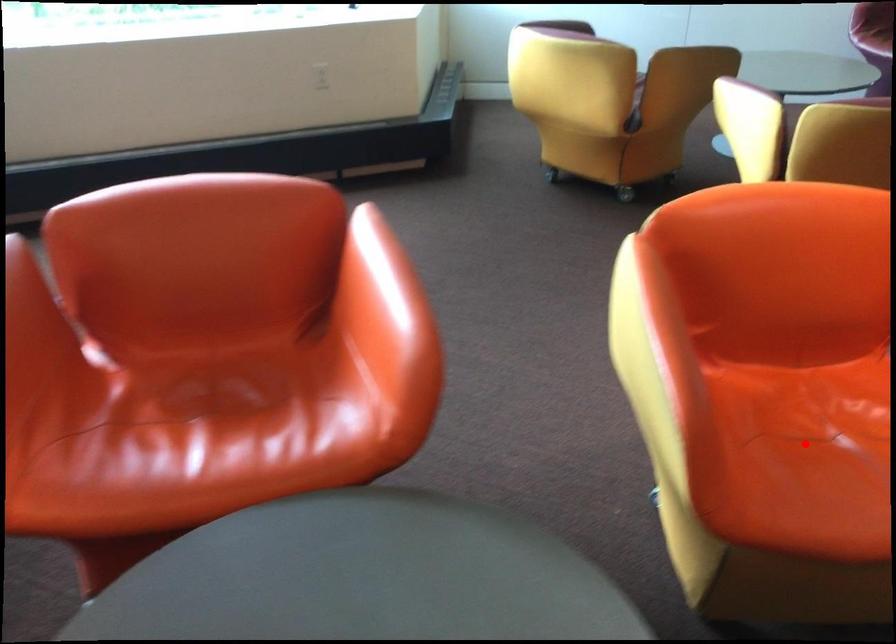
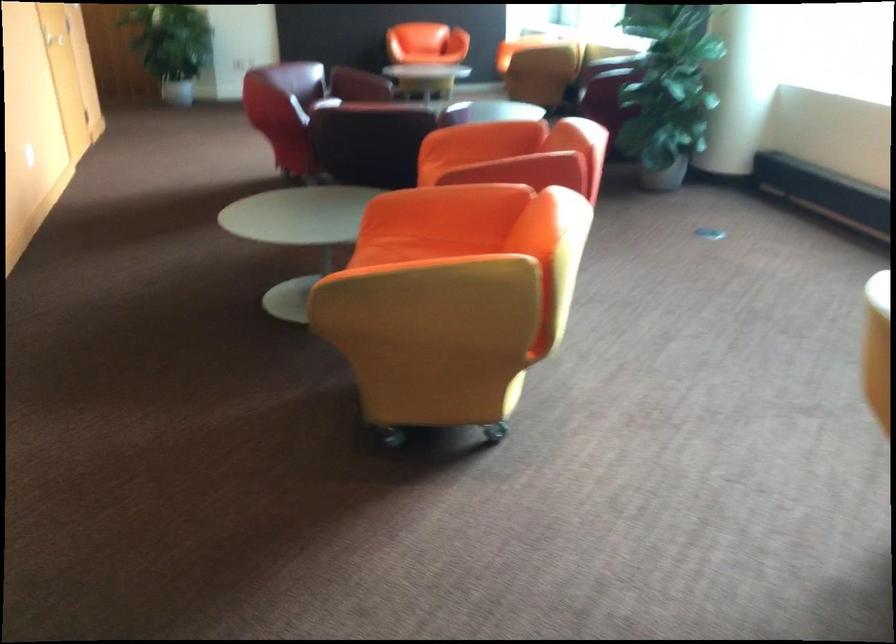
Question: I am providing you with two images of the same scene from different viewpoints. A red point is marked on the first image. Is the red point's position out of view in image 2?

Choices:
 (A) Yes
 (B) No

Answer: (A)